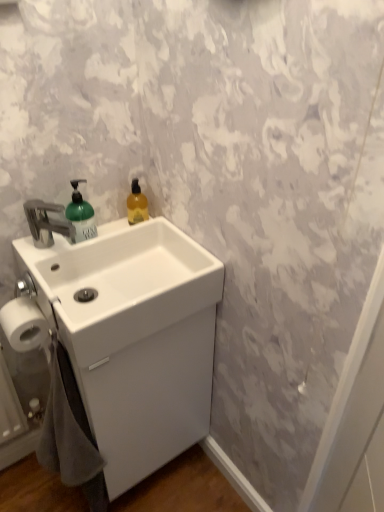
Question: Should I look upward or downward to see white glossy sink at center?

Choices:
 (A) up
 (B) down

Answer: (B)

Question: Is translucent amber liquid at upper right smaller than green matte soap dispenser at left?

Choices:
 (A) no
 (B) yes

Answer: (B)

Question: Can green matte soap dispenser at left be found inside translucent amber liquid at upper right?

Choices:
 (A) yes
 (B) no

Answer: (B)

Question: Would you say translucent amber liquid at upper right is outside green matte soap dispenser at left?

Choices:
 (A) no
 (B) yes

Answer: (B)

Question: From a real-world perspective, is translucent amber liquid at upper right physically above green matte soap dispenser at left?

Choices:
 (A) yes
 (B) no

Answer: (B)

Question: Is translucent amber liquid at upper right next to green matte soap dispenser at left and touching it?

Choices:
 (A) yes
 (B) no

Answer: (B)

Question: Considering the relative positions of translucent amber liquid at upper right and green matte soap dispenser at left in the image provided, is translucent amber liquid at upper right to the left of green matte soap dispenser at left from the viewer's perspective?

Choices:
 (A) yes
 (B) no

Answer: (B)

Question: Considering the relative sizes of white glossy sink at center and gray cotton bath towel at lower left in the image provided, is white glossy sink at center shorter than gray cotton bath towel at lower left?

Choices:
 (A) yes
 (B) no

Answer: (A)

Question: Can we say white glossy sink at center lies outside gray cotton bath towel at lower left?

Choices:
 (A) yes
 (B) no

Answer: (A)

Question: Considering the relative positions of white glossy sink at center and gray cotton bath towel at lower left in the image provided, is white glossy sink at center to the right of gray cotton bath towel at lower left from the viewer's perspective?

Choices:
 (A) yes
 (B) no

Answer: (A)

Question: Does white glossy sink at center appear on the left side of gray cotton bath towel at lower left?

Choices:
 (A) yes
 (B) no

Answer: (B)

Question: Is white glossy sink at center beside gray cotton bath towel at lower left?

Choices:
 (A) no
 (B) yes

Answer: (A)

Question: Is white glossy sink at center aimed at gray cotton bath towel at lower left?

Choices:
 (A) no
 (B) yes

Answer: (A)

Question: Considering the relative sizes of white matte toilet paper at lower left and translucent amber liquid at upper right in the image provided, is white matte toilet paper at lower left bigger than translucent amber liquid at upper right?

Choices:
 (A) yes
 (B) no

Answer: (A)